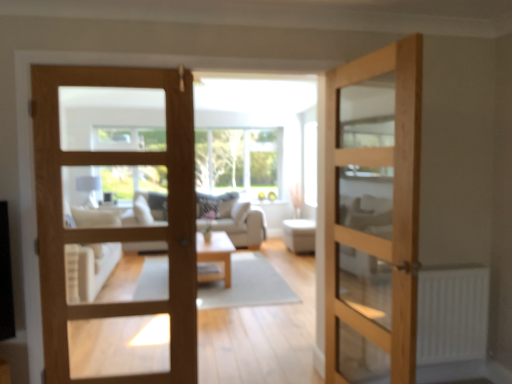
Question: Considering their positions, is white fabric ottoman at center located in front of or behind natural wood door at center, the first door in the right-to-left sequence?

Choices:
 (A) behind
 (B) front

Answer: (A)

Question: From their relative heights in the image, would you say white fabric ottoman at center is taller or shorter than natural wood door at center, the first door in the right-to-left sequence?

Choices:
 (A) tall
 (B) short

Answer: (B)

Question: Based on their relative distances, which object is nearer to the clear glass window at center?

Choices:
 (A) light brown wooden door at center, the 1th door in the left-to-right sequence
 (B) light wood/texture coffee table at center
 (C) natural wood door at center, which is the second door from left to right
 (D) white matte radiator at lower right
 (E) white fabric ottoman at center

Answer: (E)

Question: Estimate the real-world distances between objects in this image. Which object is closer to the white fabric ottoman at center?

Choices:
 (A) clear glass window at center
 (B) natural wood door at center, the first door in the right-to-left sequence
 (C) light brown wooden door at center, the 1th door in the left-to-right sequence
 (D) light wood/texture coffee table at center
 (E) white matte radiator at lower right

Answer: (D)